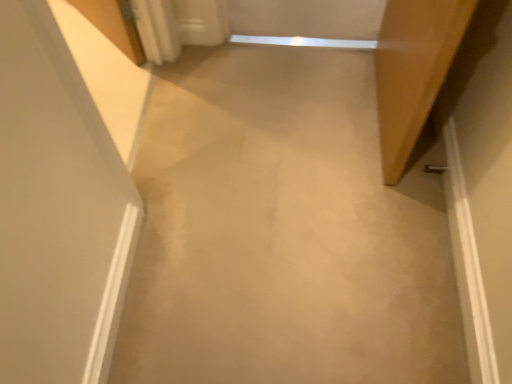
Question: Should I look upward or downward to see beige carpet at center?

Choices:
 (A) down
 (B) up

Answer: (B)